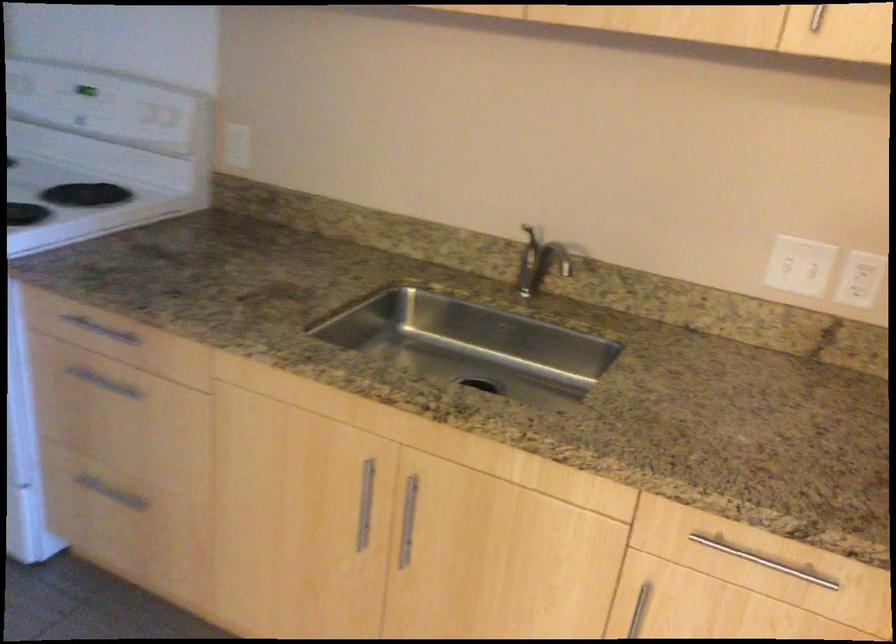
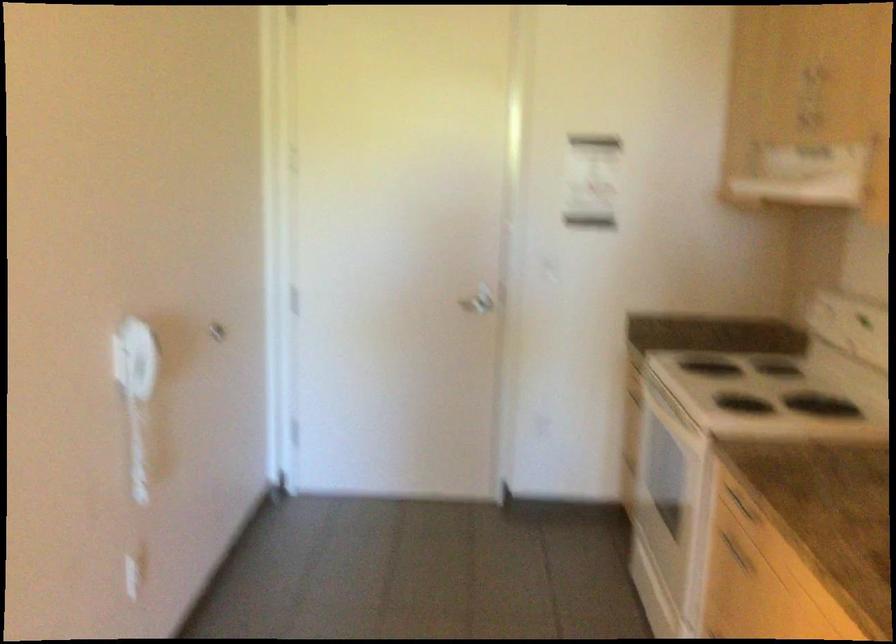
In the second image, find the point that corresponds to [92,386] in the first image.

(735, 552)